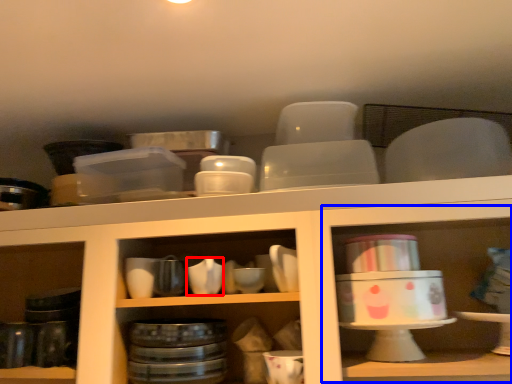
Question: Which object is further to the camera taking this photo, tableware (highlighted by a red box) or shelf (highlighted by a blue box)?

Choices:
 (A) tableware
 (B) shelf

Answer: (A)